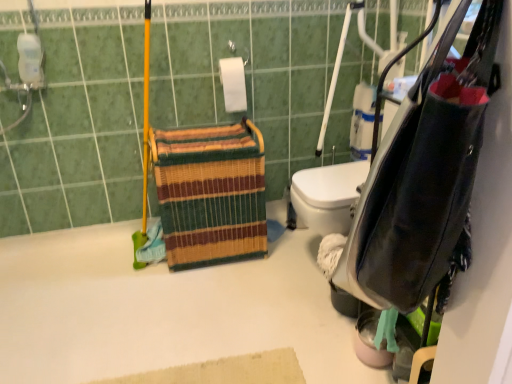
What do you see at coordinates (210, 193) in the screenshot? I see `multicolored woven basket at center` at bounding box center [210, 193].

In order to face leather-like black bag at right, should I rotate leftwards or rightwards?

To face it directly, rotate right by 20.236 degrees.

What do you see at coordinates (162, 310) in the screenshot? I see `white matte bath at upper left` at bounding box center [162, 310].

Image resolution: width=512 pixels, height=384 pixels. Find the location of `white matte toilet paper at upper center`. white matte toilet paper at upper center is located at coordinates (233, 84).

Which object is positioned more to the left, leather-like black bag at right or white matte toilet paper at upper center?

white matte toilet paper at upper center is more to the left.

Who is more distant, leather-like black bag at right or white matte toilet paper at upper center?

white matte toilet paper at upper center is further away from the camera.

Considering the relative sizes of leather-like black bag at right and white matte toilet paper at upper center in the image provided, is leather-like black bag at right wider than white matte toilet paper at upper center?

Yes.

Looking at this image, can you confirm if leather-like black bag at right is taller than white matte toilet paper at upper center?

Yes, leather-like black bag at right is taller than white matte toilet paper at upper center.

Considering the sizes of objects leather-like black bag at right and white matte bath at upper left in the image provided, who is bigger, leather-like black bag at right or white matte bath at upper left?

With larger size is white matte bath at upper left.

Which object is further away from the camera, leather-like black bag at right or white matte bath at upper left?

white matte bath at upper left is further away from the camera.

Is leather-like black bag at right inside the boundaries of white matte bath at upper left, or outside?

leather-like black bag at right is not enclosed by white matte bath at upper left.

In order to click on bath behind the leather-like black bag at right in this screenshot , I will do tap(162, 310).

Is multicolored woven basket at center taller or shorter than leather-like black bag at right?

multicolored woven basket at center is taller than leather-like black bag at right.

Which is behind, multicolored woven basket at center or leather-like black bag at right?

multicolored woven basket at center is behind.

Consider the image. Is multicolored woven basket at center surrounding leather-like black bag at right?

No, multicolored woven basket at center does not contain leather-like black bag at right.

From the image's perspective, relative to white matte toilet paper at upper center, is multicolored woven basket at center above or below?

From the image's perspective, multicolored woven basket at center appears below white matte toilet paper at upper center.

Is multicolored woven basket at center bigger than white matte toilet paper at upper center?

Indeed, multicolored woven basket at center has a larger size compared to white matte toilet paper at upper center.

Would you consider multicolored woven basket at center to be distant from white matte toilet paper at upper center?

No, multicolored woven basket at center is not far from white matte toilet paper at upper center.

Which is behind, multicolored woven basket at center or white matte toilet paper at upper center?

white matte toilet paper at upper center is behind.

Are white matte toilet paper at upper center and multicolored woven basket at center located far from each other?

That's not correct — white matte toilet paper at upper center is a little close to multicolored woven basket at center.

Does white matte toilet paper at upper center appear on the right side of multicolored woven basket at center?

Yes.

Which object is closer to the camera taking this photo, white matte toilet paper at upper center or multicolored woven basket at center?

multicolored woven basket at center is more forward.

Is white matte toilet paper at upper center smaller than multicolored woven basket at center?

Correct, white matte toilet paper at upper center occupies less space than multicolored woven basket at center.

Relative to leather-like black bag at right, is white matte toilet paper at upper center in front or behind?

Visually, white matte toilet paper at upper center is located behind leather-like black bag at right.

Measure the distance from white matte toilet paper at upper center to leather-like black bag at right.

white matte toilet paper at upper center and leather-like black bag at right are 5.08 feet apart from each other.

Would you say white matte toilet paper at upper center is inside or outside leather-like black bag at right?

white matte toilet paper at upper center is located beyond the bounds of leather-like black bag at right.

Considering the positions of objects white matte toilet paper at upper center and leather-like black bag at right in the image provided, who is more to the right, white matte toilet paper at upper center or leather-like black bag at right?

From the viewer's perspective, leather-like black bag at right appears more on the right side.

Considering the sizes of objects white matte bath at upper left and leather-like black bag at right in the image provided, who is smaller, white matte bath at upper left or leather-like black bag at right?

leather-like black bag at right.

Between point (92, 257) and point (387, 299), which one is positioned in front?

The point (387, 299) is closer to the camera.

What's the angular difference between white matte bath at upper left and leather-like black bag at right's facing directions?

149 degrees separate the facing orientations of white matte bath at upper left and leather-like black bag at right.

Is white matte bath at upper left oriented towards leather-like black bag at right?

No.

You are a GUI agent. You are given a task and a screenshot of the screen. Output one action in this format:
    pyautogui.click(x=<x>, y=<y>)
    Task: Click on the bag on the right of white matte toilet paper at upper center
    The height and width of the screenshot is (384, 512).
    Given the screenshot: What is the action you would take?
    pyautogui.click(x=423, y=175)

In the image, there is a white matte bath at upper left. At what (x,y) coordinates should I click in order to perform the action: click on bag above it (from the image's perspective). Please return your answer as a coordinate pair (x, y). Image resolution: width=512 pixels, height=384 pixels. Looking at the image, I should click on (423, 175).

Based on their spatial positions, is multicolored woven basket at center or white matte toilet paper at upper center further from leather-like black bag at right?

Based on the image, white matte toilet paper at upper center appears to be further to leather-like black bag at right.

From the image, which object appears to be nearer to white matte bath at upper left, multicolored woven basket at center or leather-like black bag at right?

multicolored woven basket at center is closer to white matte bath at upper left.

Which object lies nearer to the anchor point leather-like black bag at right, multicolored woven basket at center or white matte bath at upper left?

white matte bath at upper left is positioned closer to the anchor leather-like black bag at right.

When comparing their distances from white matte bath at upper left, does white matte toilet paper at upper center or multicolored woven basket at center seem closer?

The object closer to white matte bath at upper left is multicolored woven basket at center.

Looking at the image, which one is located further to white matte toilet paper at upper center, white matte bath at upper left or leather-like black bag at right?

leather-like black bag at right is positioned further to the anchor white matte toilet paper at upper center.

From the image, which object appears to be nearer to leather-like black bag at right, white matte toilet paper at upper center or white matte bath at upper left?

Based on the image, white matte bath at upper left appears to be nearer to leather-like black bag at right.

Looking at this image, considering their positions, is leather-like black bag at right positioned further to multicolored woven basket at center than white matte bath at upper left?

leather-like black bag at right.

Which object lies further to the anchor point multicolored woven basket at center, white matte toilet paper at upper center or leather-like black bag at right?

leather-like black bag at right.

The width and height of the screenshot is (512, 384). What are the coordinates of `basket that lies between white matte toilet paper at upper center and white matte bath at upper left from top to bottom` in the screenshot? It's located at (210, 193).

At what (x,y) coordinates should I click in order to perform the action: click on basket positioned between leather-like black bag at right and white matte toilet paper at upper center from near to far. Please return your answer as a coordinate pair (x, y). The height and width of the screenshot is (384, 512). Looking at the image, I should click on (210, 193).

The width and height of the screenshot is (512, 384). I want to click on bath between leather-like black bag at right and multicolored woven basket at center from front to back, so click(x=162, y=310).

The width and height of the screenshot is (512, 384). Identify the location of bath between leather-like black bag at right and white matte toilet paper at upper center along the z-axis. (162, 310).